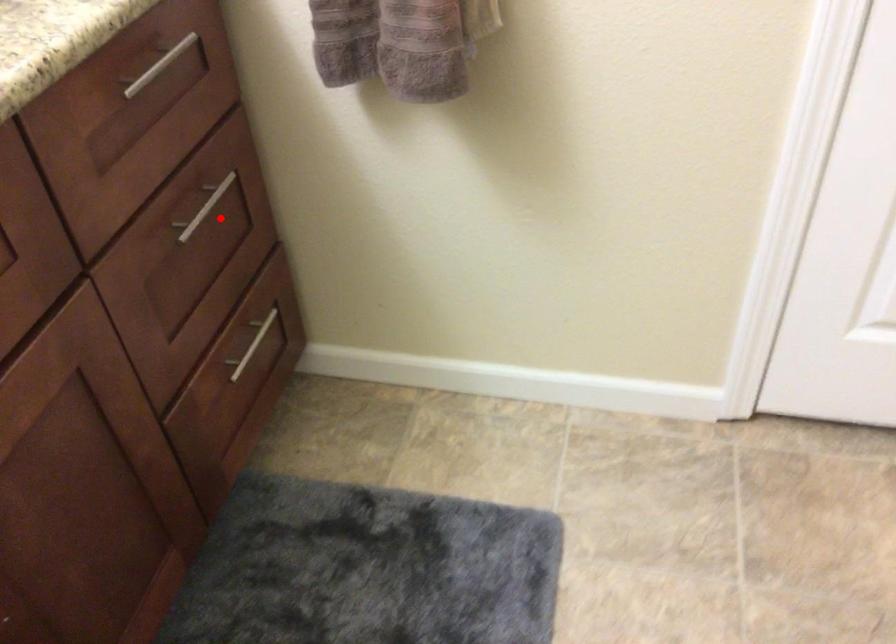
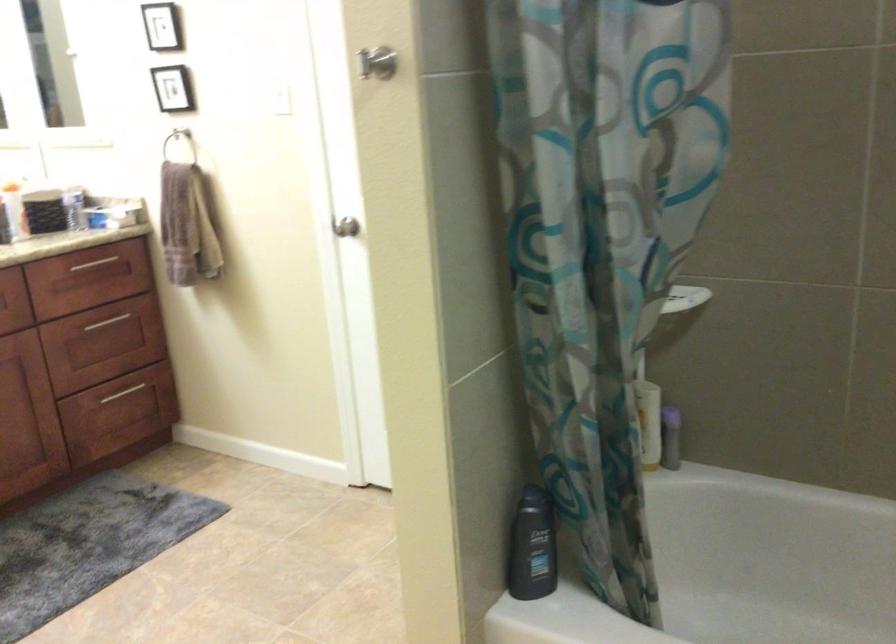
Where in the second image is the point corresponding to the highlighted location from the first image?

(115, 323)